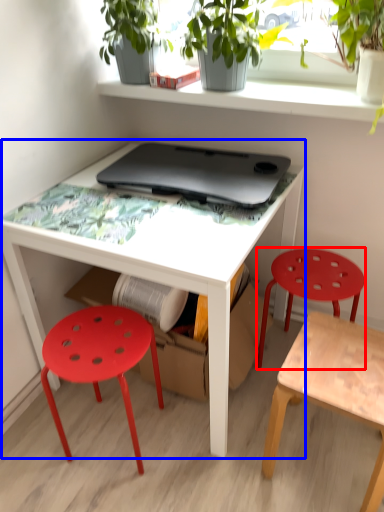
Question: Which object is closer to the camera taking this photo, stool (highlighted by a red box) or table (highlighted by a blue box)?

Choices:
 (A) stool
 (B) table

Answer: (B)